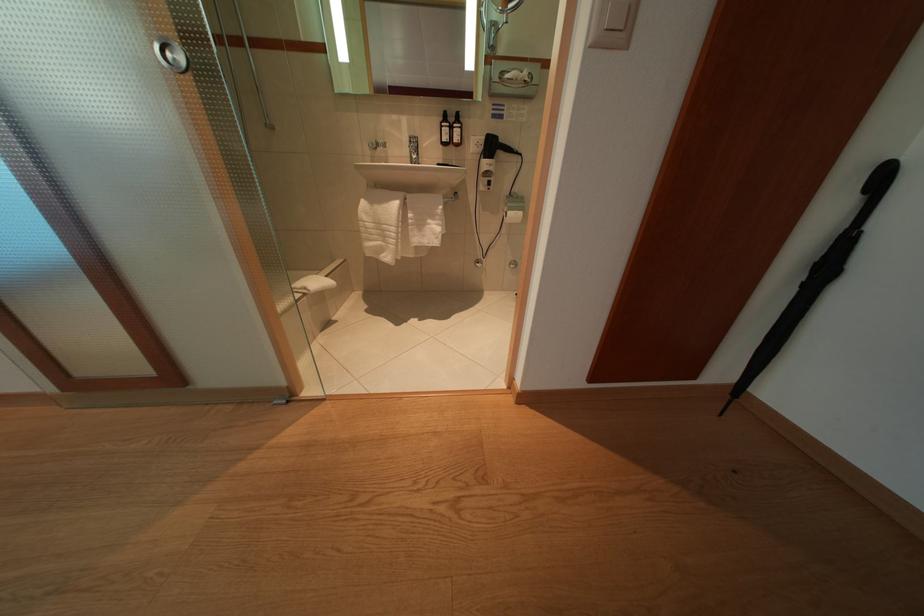
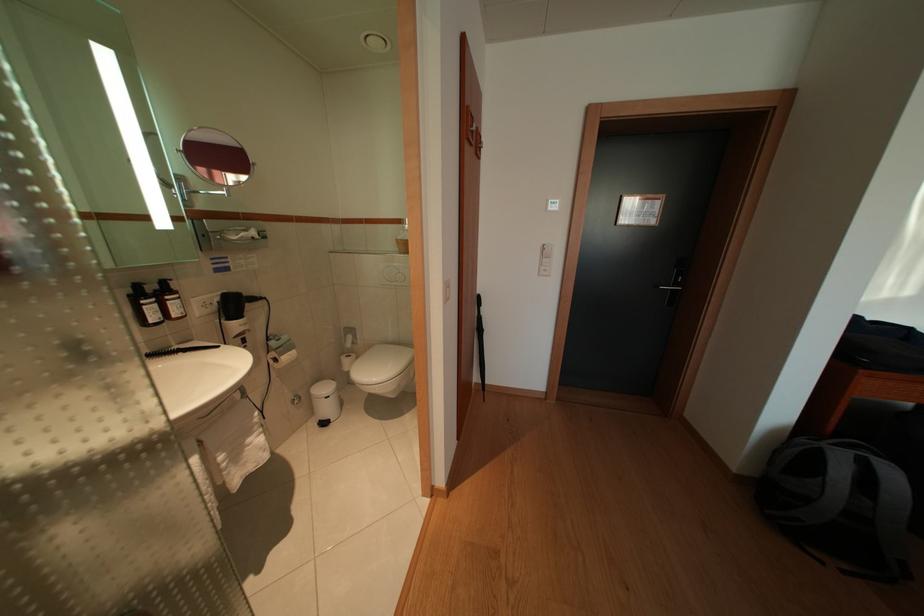
Question: The images are taken continuously from a first-person perspective. In which direction is your viewpoint rotating?

Choices:
 (A) Left
 (B) Right
 (C) Up
 (D) Down

Answer: (B)